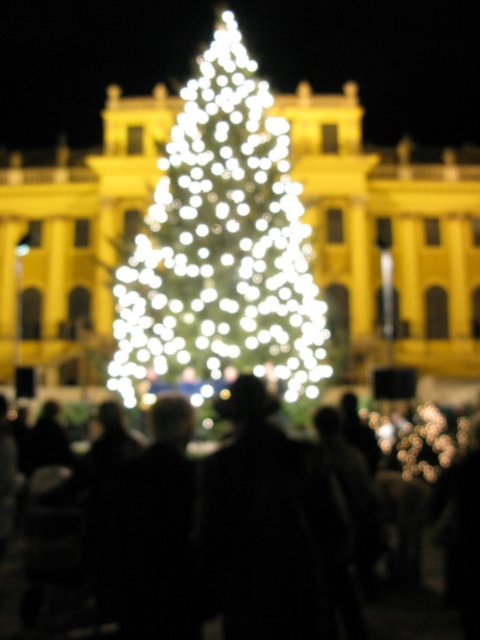
Is illuminated glass christmas tree at center to the left of black matte crowd at lower center from the viewer's perspective?

Yes, illuminated glass christmas tree at center is to the left of black matte crowd at lower center.

Measure the distance between illuminated glass christmas tree at center and camera.

illuminated glass christmas tree at center and camera are 79.88 meters apart.

Which is behind, point (263, 147) or point (451, 627)?

Point (263, 147)

Identify the location of illuminated glass christmas tree at center. (220, 250).

Which is behind, point (51, 196) or point (404, 609)?

Point (51, 196)

Is point (420, 332) in front of point (395, 634)?

No, it is not.

Is point (7, 317) in front of point (61, 632)?

No, it is behind (61, 632).

Where is `yellow matte building at center`? Image resolution: width=480 pixels, height=640 pixels. yellow matte building at center is located at coordinates (387, 237).

Between yellow matte building at center and illuminated glass christmas tree at center, which one has more height?

Standing taller between the two is illuminated glass christmas tree at center.

Can you confirm if yellow matte building at center is positioned above illuminated glass christmas tree at center?

No.

Is point (422, 211) positioned behind point (216, 99)?

Yes, point (422, 211) is behind point (216, 99).

Image resolution: width=480 pixels, height=640 pixels. In order to click on yellow matte building at center in this screenshot , I will do `click(387, 237)`.